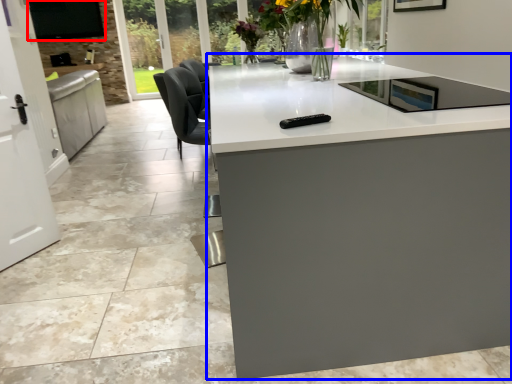
Question: Which point is further to the camera, window screen (highlighted by a red box) or countertop (highlighted by a blue box)?

Choices:
 (A) window screen
 (B) countertop

Answer: (A)